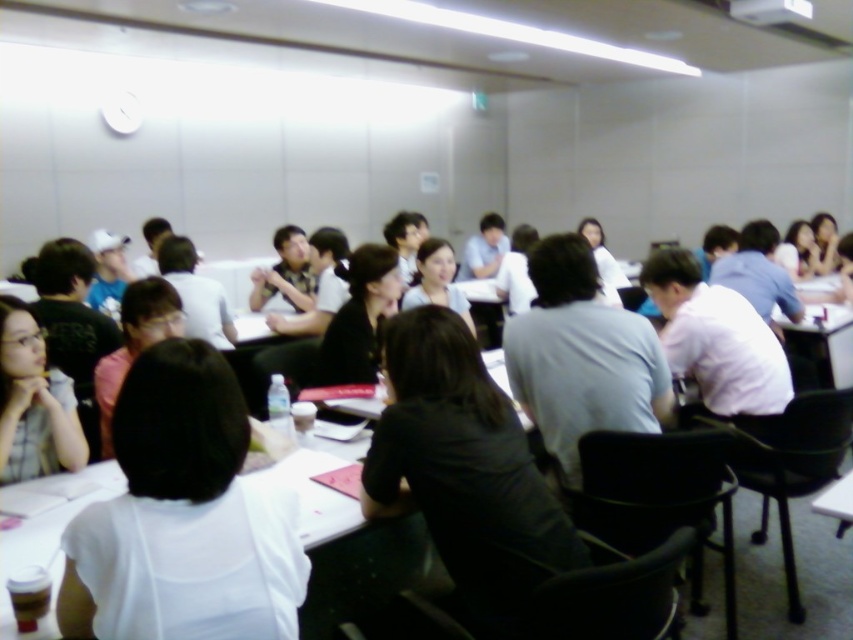
You are organizing a presentation and need to ensure that all visual aids are clearly visible to everyone in the room. Considering the placement of the matte black glasses at lower left and the black matte shirt at center, which object might obstruct the view of the presentation screen more if placed in front of it?

The black matte shirt at center has a greater height than the matte black glasses at lower left, so it would obstruct the view more if placed in front of the presentation screen.

You are standing in the conference room and want to walk to the point that is closer to you. Which point should you head towards, point (x=234, y=536) or point (x=7, y=317)?

You should head towards point (x=234, y=536) because it is closer to the viewer than point (x=7, y=317).